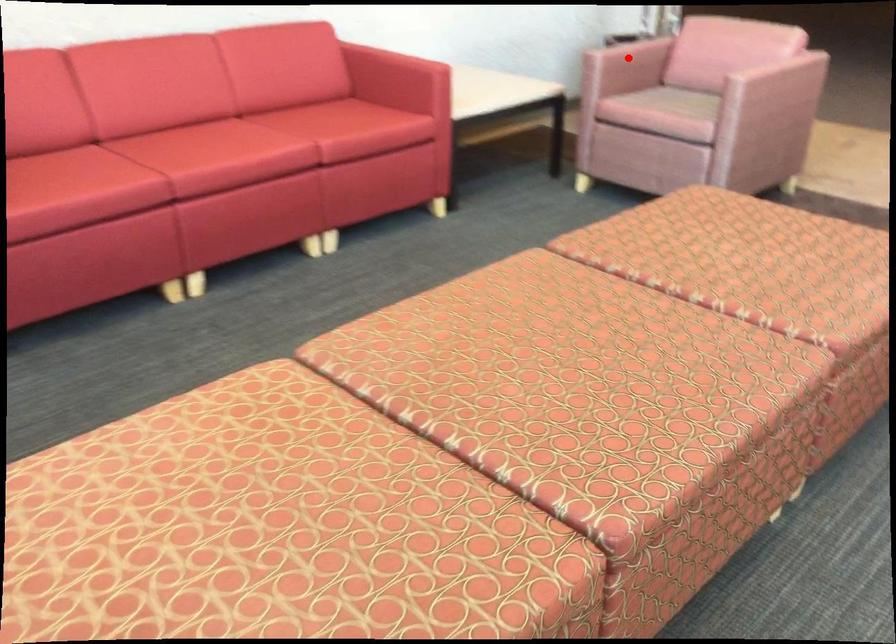
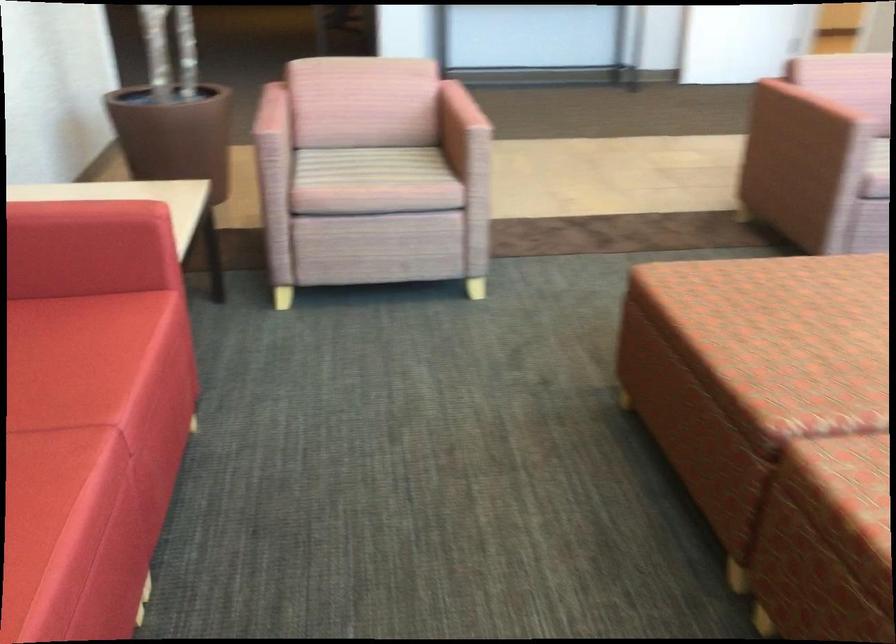
Question: I am providing you with two images of the same scene from different viewpoints. A red point is marked on the first image. Can you still see the location of the red point in image 2?

Choices:
 (A) Yes
 (B) No

Answer: (B)